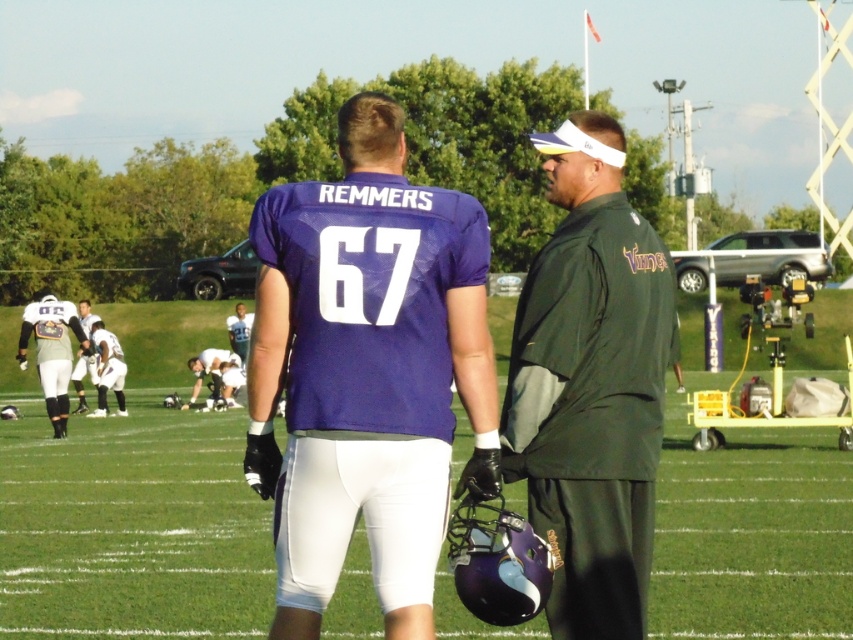
Question: Which point is farther to the camera?

Choices:
 (A) green artificial turf at center
 (B) purple fabric uniform at center
 (C) white uniform at lower left

Answer: (C)

Question: Which of the following is the closest to the observer?

Choices:
 (A) (103, 326)
 (B) (393, 445)
 (C) (39, 333)
 (D) (21, 445)

Answer: (B)

Question: Observing the image, what is the correct spatial positioning of green artificial turf at center in reference to green fabric jacket at right?

Choices:
 (A) below
 (B) above

Answer: (A)

Question: Considering the relative positions of green artificial turf at center and silver metallic helmet at lower left in the image provided, where is green artificial turf at center located with respect to silver metallic helmet at lower left?

Choices:
 (A) above
 (B) below

Answer: (B)

Question: Is green fabric jacket at right smaller than silver metallic helmet at lower left?

Choices:
 (A) yes
 (B) no

Answer: (A)

Question: Which object is the closest to the green fabric jacket at right?

Choices:
 (A) white matte uniform at lower left
 (B) white uniform at lower left
 (C) purple fabric uniform at center
 (D) silver metallic helmet at lower left

Answer: (C)